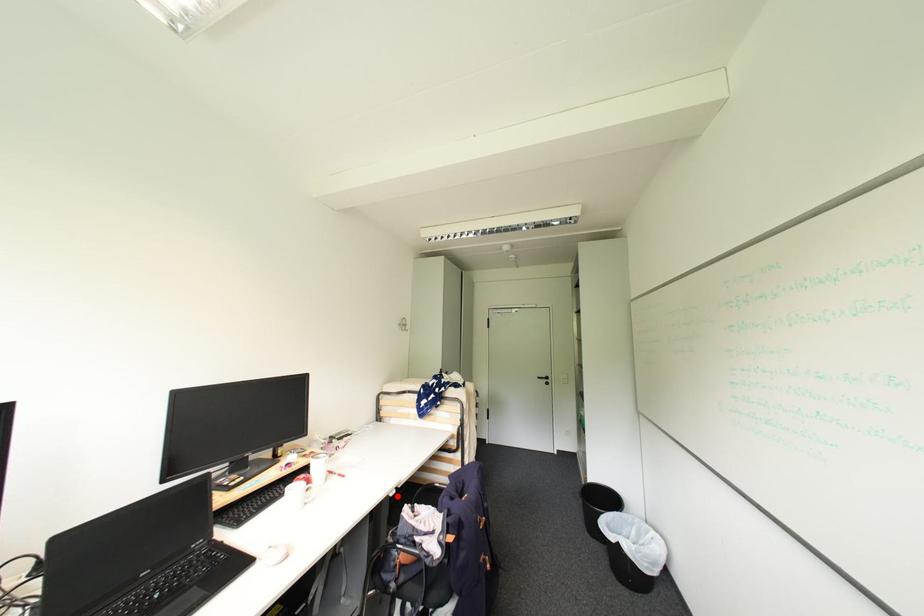
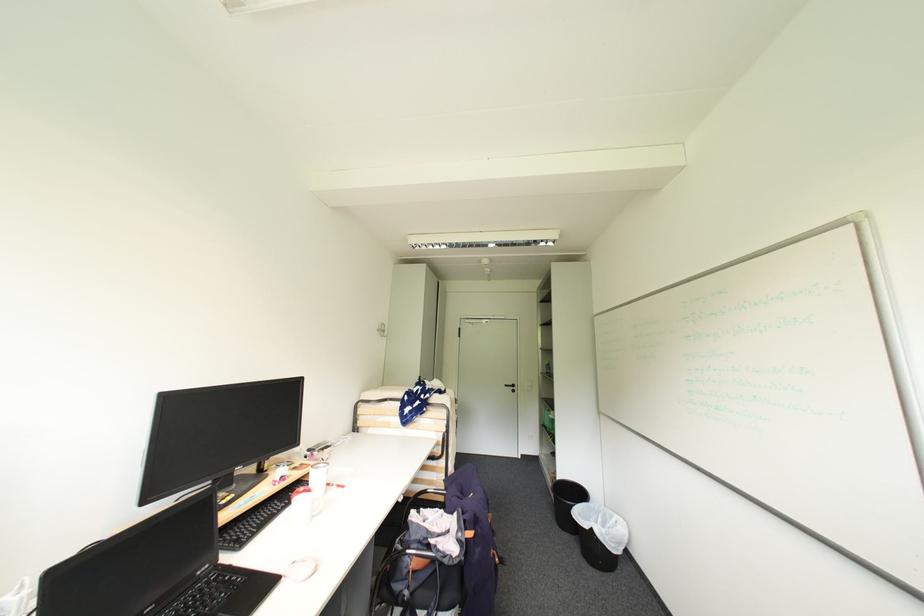
Question: A red point is marked in image1. In image2, is the corresponding 3D point closer to the camera or farther? Reply with the corresponding letter.

Choices:
 (A) The corresponding 3D point is closer.
 (B) The corresponding 3D point is farther.

Answer: (B)